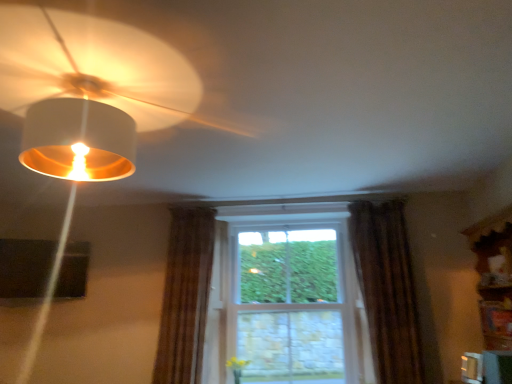
Question: Considering the relative sizes of brown textured curtain at right, which appears as the second curtain when viewed from the left, and clear glass window at center in the image provided, is brown textured curtain at right, which appears as the second curtain when viewed from the left, bigger than clear glass window at center?

Choices:
 (A) no
 (B) yes

Answer: (A)

Question: Is brown textured curtain at right, which appears as the second curtain when viewed from the left, touching clear glass window at center?

Choices:
 (A) yes
 (B) no

Answer: (B)

Question: Considering the relative sizes of brown textured curtain at right, arranged as the 1th curtain when viewed from the right, and clear glass window at center in the image provided, is brown textured curtain at right, arranged as the 1th curtain when viewed from the right, taller than clear glass window at center?

Choices:
 (A) yes
 (B) no

Answer: (A)

Question: Is brown textured curtain at right, which appears as the second curtain when viewed from the left, smaller than clear glass window at center?

Choices:
 (A) yes
 (B) no

Answer: (A)

Question: Considering the relative positions of brown textured curtain at right, which appears as the second curtain when viewed from the left, and clear glass window at center in the image provided, is brown textured curtain at right, which appears as the second curtain when viewed from the left, to the left of clear glass window at center from the viewer's perspective?

Choices:
 (A) no
 (B) yes

Answer: (A)

Question: Is brown textured curtain at right, which appears as the second curtain when viewed from the left, turned away from clear glass window at center?

Choices:
 (A) no
 (B) yes

Answer: (A)

Question: From the image's perspective, would you say brown textured curtain at center, placed as the first curtain when sorted from left to right, is shown under matte white lampshade at upper left?

Choices:
 (A) no
 (B) yes

Answer: (B)

Question: From a real-world perspective, is brown textured curtain at center, placed as the first curtain when sorted from left to right, located beneath matte white lampshade at upper left?

Choices:
 (A) no
 (B) yes

Answer: (B)

Question: Considering the relative sizes of brown textured curtain at center, the 2th curtain viewed from the right, and matte white lampshade at upper left in the image provided, is brown textured curtain at center, the 2th curtain viewed from the right, shorter than matte white lampshade at upper left?

Choices:
 (A) no
 (B) yes

Answer: (A)

Question: Is brown textured curtain at center, the 2th curtain viewed from the right, outside of matte white lampshade at upper left?

Choices:
 (A) no
 (B) yes

Answer: (B)

Question: Does brown textured curtain at center, placed as the first curtain when sorted from left to right, have a greater width compared to matte white lampshade at upper left?

Choices:
 (A) no
 (B) yes

Answer: (A)

Question: Is brown textured curtain at center, placed as the first curtain when sorted from left to right, thinner than matte white lampshade at upper left?

Choices:
 (A) no
 (B) yes

Answer: (B)

Question: Considering the relative positions of clear glass window at center and matte white lampshade at upper left in the image provided, is clear glass window at center to the right of matte white lampshade at upper left from the viewer's perspective?

Choices:
 (A) no
 (B) yes

Answer: (B)